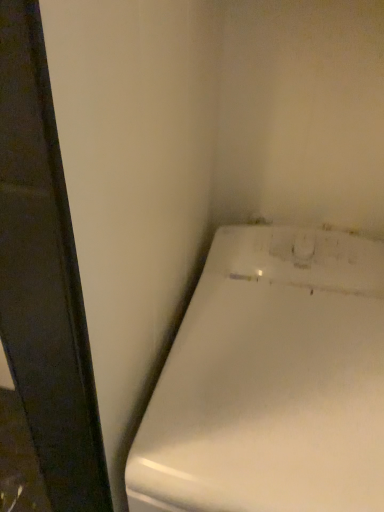
You are a GUI agent. You are given a task and a screenshot of the screen. Output one action in this format:
    pyautogui.click(x=<x>, y=<y>)
    Task: Click on the white glossy bathtub at lower right
    The image size is (384, 512).
    Given the screenshot: What is the action you would take?
    pyautogui.click(x=271, y=381)

Measure the distance between point (170, 429) and camera.

22.32 inches.

Describe the element at coordinates (271, 381) in the screenshot. I see `white glossy bathtub at lower right` at that location.

You are a GUI agent. You are given a task and a screenshot of the screen. Output one action in this format:
    pyautogui.click(x=<x>, y=<y>)
    Task: Click on the white glossy bathtub at lower right
    The image size is (384, 512).
    Given the screenshot: What is the action you would take?
    pyautogui.click(x=271, y=381)